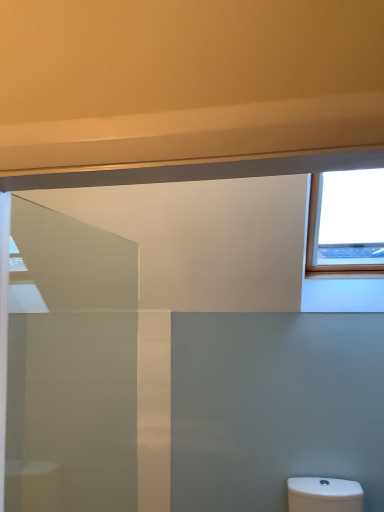
What do you see at coordinates (71, 366) in the screenshot? The height and width of the screenshot is (512, 384). I see `satin glass screen door at left` at bounding box center [71, 366].

Image resolution: width=384 pixels, height=512 pixels. I want to click on satin glass screen door at left, so click(71, 366).

Find the location of a particular element. satin glass screen door at left is located at coordinates (71, 366).